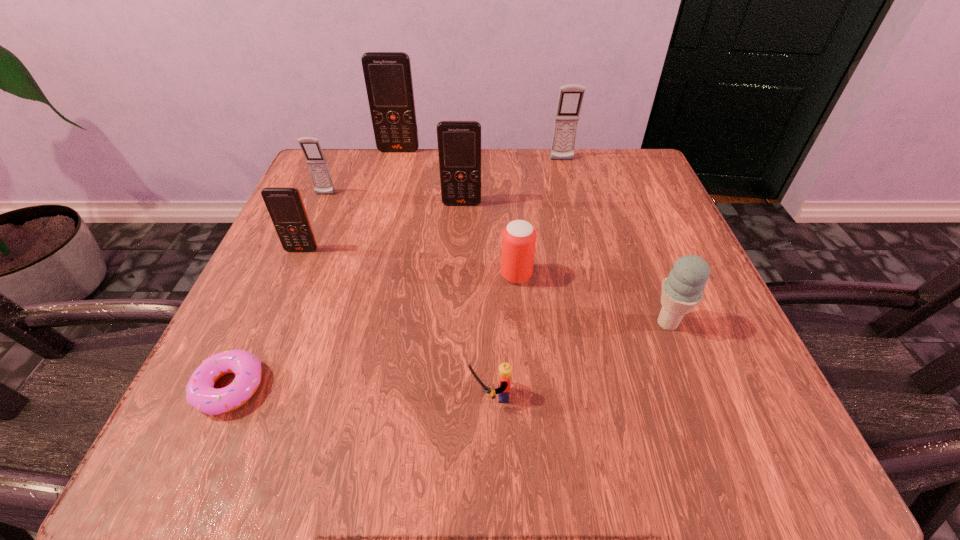
Find the location of a particular element. unoccupied position between the nearest orange cellular telephone and the smaller gray cellular telephone is located at coordinates (313, 222).

Where is `free space that is in between the sixth farthest object and the tallest object`? The width and height of the screenshot is (960, 540). free space that is in between the sixth farthest object and the tallest object is located at coordinates (458, 213).

Where is `unoccupied area between the third cellular telephone from left to right and the nearest cellular telephone`? The image size is (960, 540). unoccupied area between the third cellular telephone from left to right and the nearest cellular telephone is located at coordinates (350, 200).

Find the location of `free space between the leftmost orange cellular telephone and the farthest cellular telephone`. free space between the leftmost orange cellular telephone and the farthest cellular telephone is located at coordinates (350, 200).

I want to click on vacant space that's between the third cellular telephone from right to left and the nearest orange cellular telephone, so click(350, 200).

At what (x,y) coordinates should I click in order to perform the action: click on free spot between the Lego and the leftmost orange cellular telephone. Please return your answer as a coordinate pair (x, y). Looking at the image, I should click on (396, 322).

Identify the location of free space that is in between the biggest orange cellular telephone and the smallest orange cellular telephone. This screenshot has width=960, height=540. (350, 200).

Locate an element on the screen. Image resolution: width=960 pixels, height=540 pixels. free area in between the beer can and the farthest cellular telephone is located at coordinates (458, 213).

This screenshot has width=960, height=540. Find the location of `free space between the third nearest cellular telephone and the fourth farthest cellular telephone`. free space between the third nearest cellular telephone and the fourth farthest cellular telephone is located at coordinates (394, 199).

This screenshot has height=540, width=960. Find the location of `object that is the fifth closest one to the beer can`. object that is the fifth closest one to the beer can is located at coordinates (571, 96).